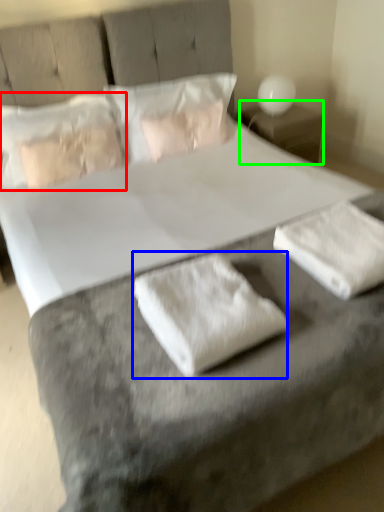
Question: Based on their relative distances, which object is farther from pillow (highlighted by a red box)? Choose from material (highlighted by a blue box) and nightstand (highlighted by a green box).

Choices:
 (A) material
 (B) nightstand

Answer: (A)